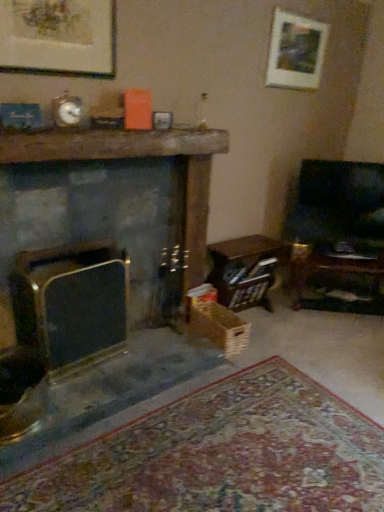
Question: Is matte black fireplace at left, the second fireplace positioned from the right, outside white matte picture frame at upper right, the 1th picture frame viewed from the right?

Choices:
 (A) no
 (B) yes

Answer: (B)

Question: Can you confirm if matte black fireplace at left, which is the first fireplace from left to right, is positioned to the right of white matte picture frame at upper right, acting as the first picture frame starting from the back?

Choices:
 (A) yes
 (B) no

Answer: (B)

Question: Is matte black fireplace at left, which is the first fireplace from left to right, next to white matte picture frame at upper right, placed as the 2th picture frame when sorted from front to back?

Choices:
 (A) yes
 (B) no

Answer: (B)

Question: Does matte black fireplace at left, the second fireplace positioned from the right, have a larger size compared to white matte picture frame at upper right, which is counted as the 1th picture frame, starting from the top?

Choices:
 (A) no
 (B) yes

Answer: (B)

Question: Considering the relative sizes of matte black fireplace at left, which is the first fireplace from left to right, and white matte picture frame at upper right, placed as the 2th picture frame when sorted from front to back, in the image provided, is matte black fireplace at left, which is the first fireplace from left to right, wider than white matte picture frame at upper right, placed as the 2th picture frame when sorted from front to back,?

Choices:
 (A) no
 (B) yes

Answer: (B)

Question: Is point (39, 35) positioned closer to the camera than point (89, 141)?

Choices:
 (A) farther
 (B) closer

Answer: (B)

Question: Choose the correct answer: Is matte gold picture frame at upper left, which is the 2th picture frame in top-to-bottom order, inside dark gray stone fireplace at center, which is the second fireplace in left-to-right order, or outside it?

Choices:
 (A) inside
 (B) outside

Answer: (B)

Question: Based on their positions, is matte gold picture frame at upper left, which appears as the 2th picture frame when viewed from the right, located to the left or right of dark gray stone fireplace at center, placed as the 1th fireplace when sorted from right to left?

Choices:
 (A) right
 (B) left

Answer: (B)

Question: Considering their positions, is matte gold picture frame at upper left, arranged as the 2th picture frame when viewed from the back, located in front of or behind dark gray stone fireplace at center, which is the second fireplace in left-to-right order?

Choices:
 (A) behind
 (B) front

Answer: (B)

Question: Is matte black fireplace at left, which is the first fireplace from left to right, spatially inside white matte picture frame at upper right, the second picture frame from the bottom, or outside of it?

Choices:
 (A) outside
 (B) inside

Answer: (A)

Question: From the image's perspective, is matte black fireplace at left, which is the first fireplace from left to right, above or below white matte picture frame at upper right, the 1th picture frame viewed from the right?

Choices:
 (A) above
 (B) below

Answer: (B)

Question: Based on their positions, is matte black fireplace at left, which is the first fireplace from left to right, located to the left or right of white matte picture frame at upper right, the 2th picture frame in the left-to-right sequence?

Choices:
 (A) right
 (B) left

Answer: (B)

Question: Considering the positions of matte black fireplace at left, the second fireplace positioned from the right, and white matte picture frame at upper right, which is counted as the 1th picture frame, starting from the top, in the image, is matte black fireplace at left, the second fireplace positioned from the right, bigger or smaller than white matte picture frame at upper right, which is counted as the 1th picture frame, starting from the top,?

Choices:
 (A) small
 (B) big

Answer: (B)

Question: Considering the positions of point (377, 226) and point (195, 318), is point (377, 226) closer or farther from the camera than point (195, 318)?

Choices:
 (A) closer
 (B) farther

Answer: (B)

Question: From their relative heights in the image, would you say dark wood rocking chair at right is taller or shorter than wooden crate at lower center?

Choices:
 (A) short
 (B) tall

Answer: (B)